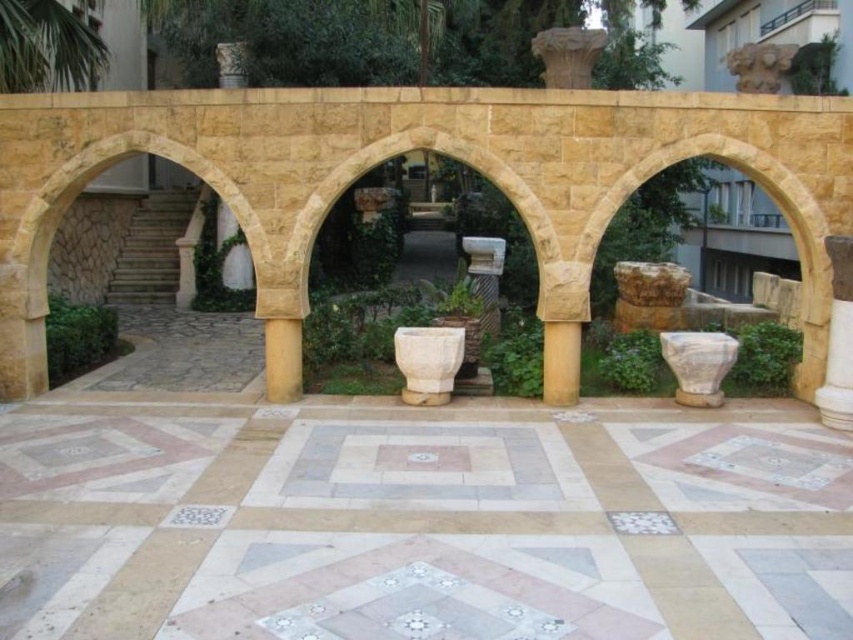
Does white stone urn at center have a greater height compared to smooth stone column at center?

In fact, white stone urn at center may be shorter than smooth stone column at center.

I want to click on white stone urn at center, so click(x=428, y=362).

The width and height of the screenshot is (853, 640). Find the location of `white stone urn at center`. white stone urn at center is located at coordinates (428, 362).

Find the location of a particular element. The width and height of the screenshot is (853, 640). white stone urn at center is located at coordinates (428, 362).